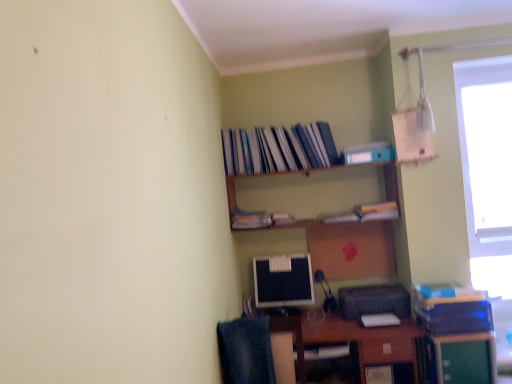
Find the location of a particular element. This screenshot has height=384, width=512. blank space situated above transparent glass window at upper right (from a real-world perspective) is located at coordinates (483, 70).